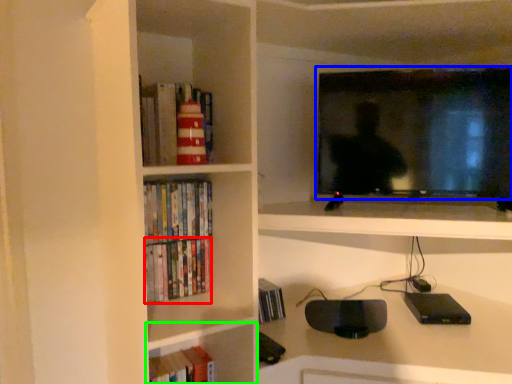
Question: Based on their relative distances, which object is nearer to book (highlighted by a red box)? Choose from television (highlighted by a blue box) and shelf (highlighted by a green box).

Choices:
 (A) television
 (B) shelf

Answer: (B)